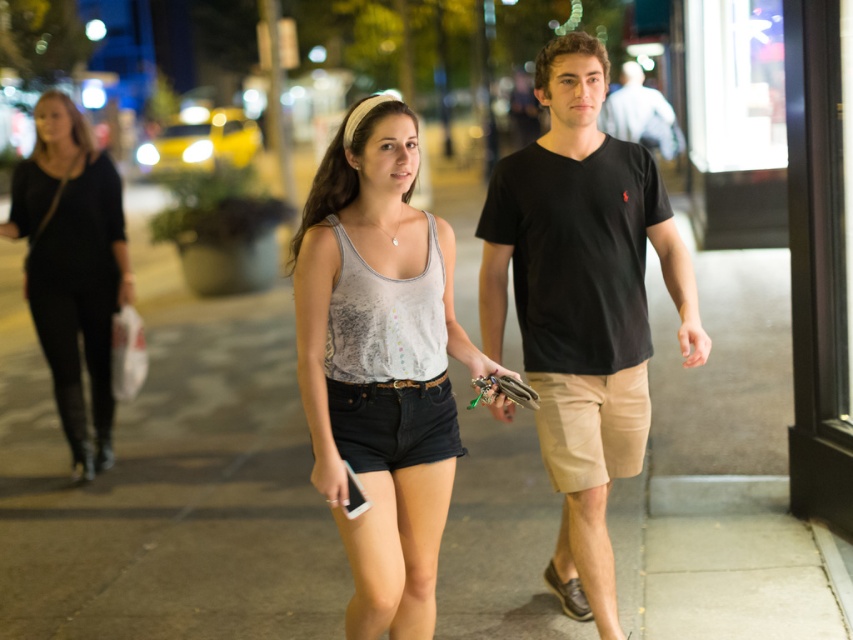
You are a fashion designer observing the nighttime urban scene. You notice the distressed white tank top at center and the brown leather sandal at lower right. Which of these two items has a larger size?

The distressed white tank top at center has a larger size compared to the brown leather sandal at lower right.

You are standing at the camera position and want to know how far the point at coordinates (537, 180) is from you. Can you determine the distance?

The point at coordinates (537, 180) is 4.47 meters away from the camera position.